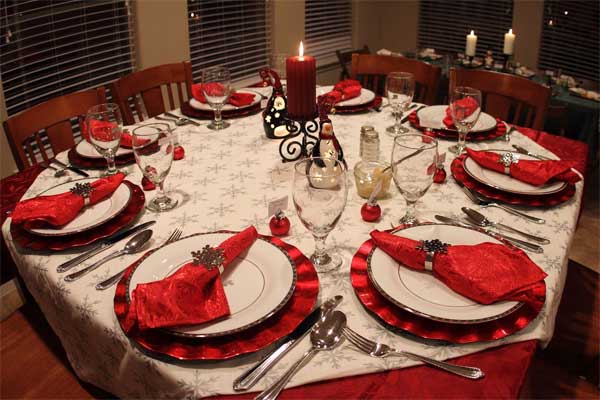
Find the location of `plates`. plates is located at coordinates [433, 286], [509, 177], [487, 122], [364, 100], [228, 107], [116, 149], [111, 215], [249, 264].